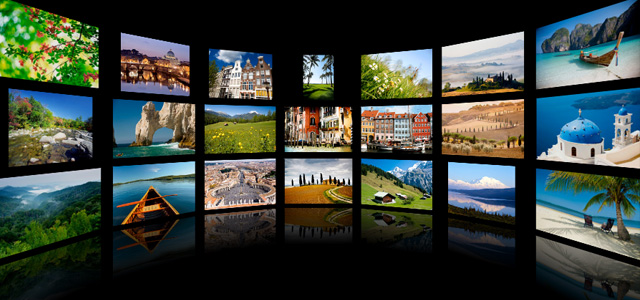
Locate an element on the screen. The image size is (640, 300). right tv screens is located at coordinates (461, 73), (482, 143), (486, 197), (602, 214), (596, 120), (596, 29).